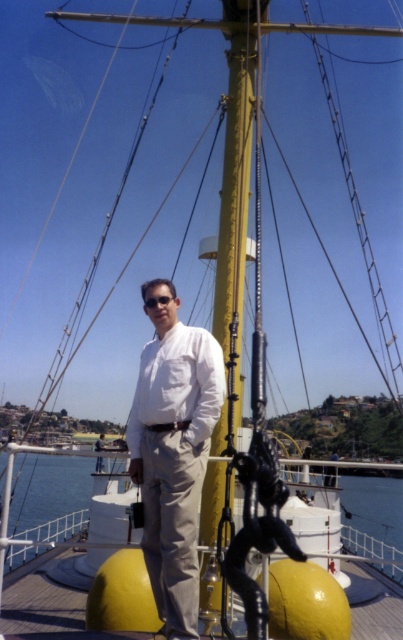
Who is higher up, white matte dress shirt at center or white matte shirt at center?

white matte dress shirt at center is above.

Is point (188, 387) positioned after point (101, 440)?

No, (188, 387) is closer to viewer.

Does point (189, 356) lie in front of point (101, 440)?

Yes, it is in front of point (101, 440).

You are a GUI agent. You are given a task and a screenshot of the screen. Output one action in this format:
    pyautogui.click(x=<x>, y=<y>)
    Task: Click on the white matte dress shirt at center
    Image resolution: width=403 pixels, height=640 pixels.
    Given the screenshot: What is the action you would take?
    point(178,385)

From the picture: Does white cotton shirt at center appear on the left side of clear plastic goggles at center?

In fact, white cotton shirt at center is to the right of clear plastic goggles at center.

Which is more to the left, white cotton shirt at center or clear plastic goggles at center?

clear plastic goggles at center is more to the left.

Is point (205, 448) positioned after point (159, 288)?

No, (205, 448) is closer to viewer.

Locate an element on the screen. This screenshot has height=640, width=403. white cotton shirt at center is located at coordinates (174, 458).

Can you confirm if transparent water at lower center is wider than white matte shirt at center?

Indeed, transparent water at lower center has a greater width compared to white matte shirt at center.

Does point (371, 548) come farther from viewer compared to point (95, 445)?

No, (371, 548) is closer to viewer.

Identify the location of transparent water at lower center. This screenshot has width=403, height=640. (51, 497).